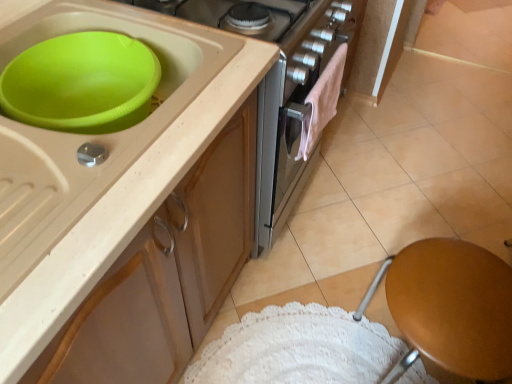
Identify the location of free space above beige matte tile at upper right (from a real-world perspective). (476, 23).